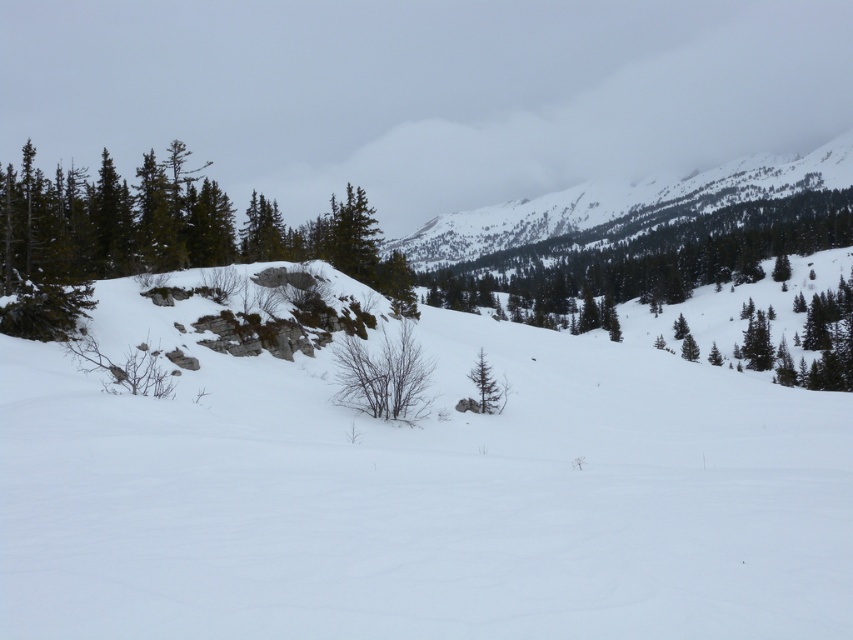
Looking at this image, you are an outdoor photographer aiming to capture the green matte tree at center and the white powdery snow at center in a single frame. Based on their positions, which object should you adjust your camera focus on first to ensure both are in the same shot?

The white powdery snow at center is positioned on the right side of green matte tree at center. To capture both in the same frame, focus on the green matte tree at center first since it is closer to the left side, allowing the snow to naturally fall into the right side of the frame.